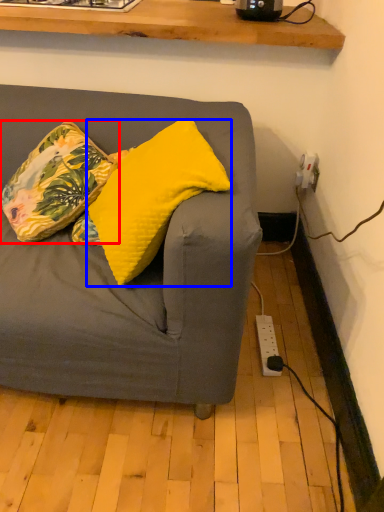
Question: Which object is further to the camera taking this photo, pillow (highlighted by a red box) or pillow (highlighted by a blue box)?

Choices:
 (A) pillow
 (B) pillow

Answer: (A)